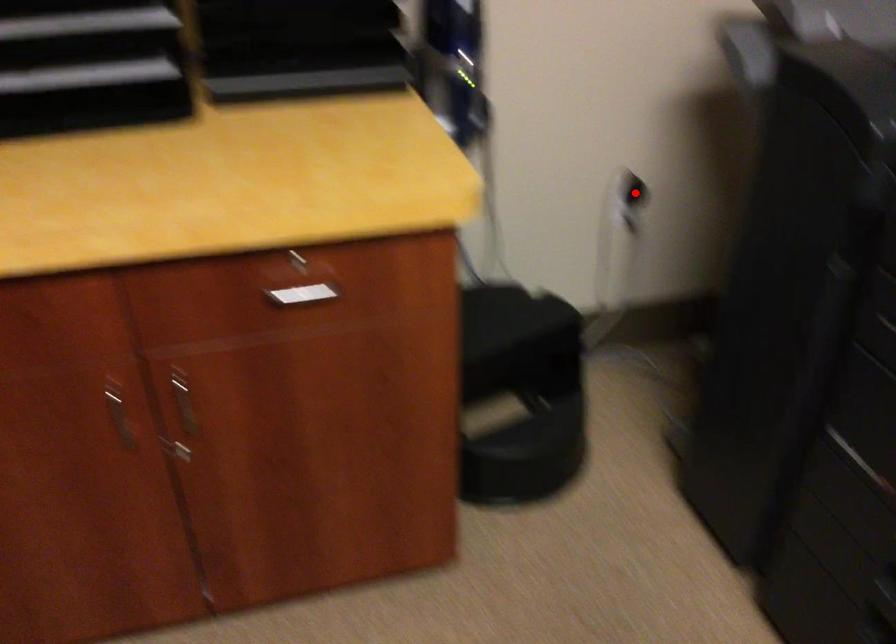
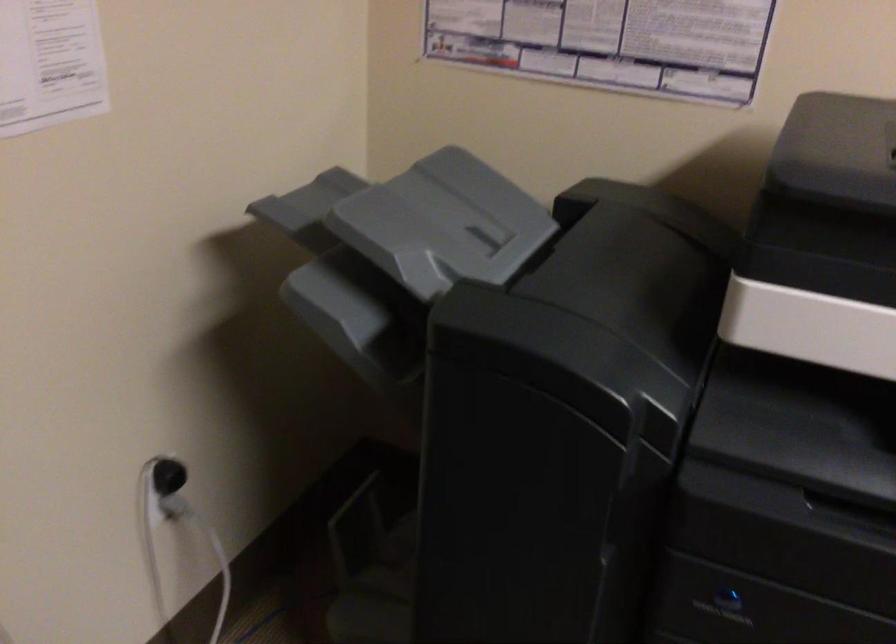
Question: A red point is marked in image1. In image2, is the corresponding 3D point closer to the camera or farther? Reply with the corresponding letter.

Choices:
 (A) The corresponding 3D point is closer.
 (B) The corresponding 3D point is farther.

Answer: (A)